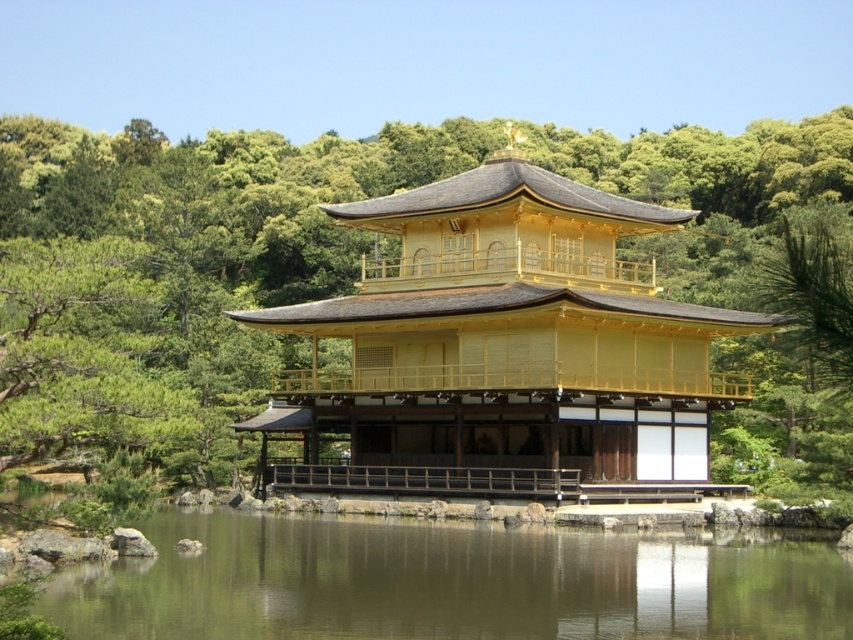
Question: Does gold polished wood gazebo at center have a smaller size compared to green reflective water at lower center?

Choices:
 (A) no
 (B) yes

Answer: (A)

Question: Can you confirm if gold polished wood gazebo at center is positioned below green reflective water at lower center?

Choices:
 (A) no
 (B) yes

Answer: (A)

Question: Can you confirm if gold polished wood gazebo at center is positioned to the right of green reflective water at lower center?

Choices:
 (A) no
 (B) yes

Answer: (A)